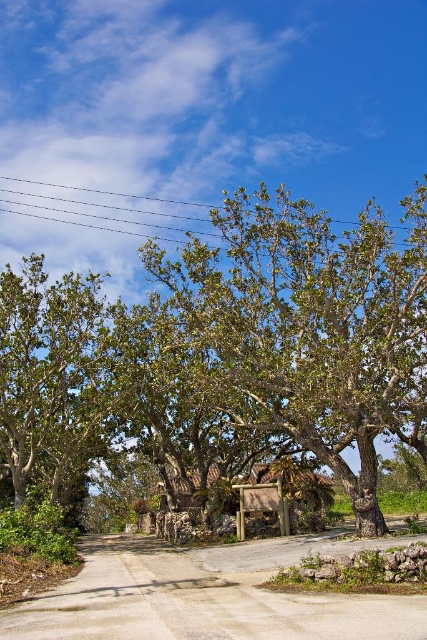
You are a bird flying over the scene and want to land on the highest object. Which object should you choose between the green leafy tree at center and the black wire at upper center?

The green leafy tree at center is taller than the black wire at upper center, so you should land on the green leafy tree at center.

You are a hiker standing at the start of the path and see the green leafy tree at center and the black wire at upper center. Which object is closer to the left side of your view?

The green leafy tree at center is closer to the left side of your view because it is positioned to the left of the black wire at upper center.

You are a landscape architect designing a new garden layout. You need to place a new bench between the green leafy tree at left and the black wire at upper center. Which object should the bench be closer to to ensure it doesn

The bench should be placed closer to the green leafy tree at left because it has a lesser width compared to the black wire at upper center, so there is more space available between them near the wider object.